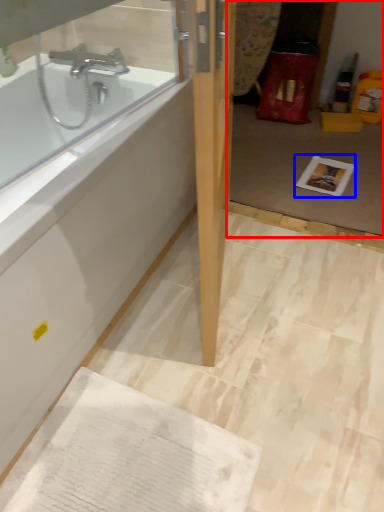
Question: Which object appears closest to the camera in this image, glass door (highlighted by a red box) or copy (highlighted by a blue box)?

Choices:
 (A) glass door
 (B) copy

Answer: (A)